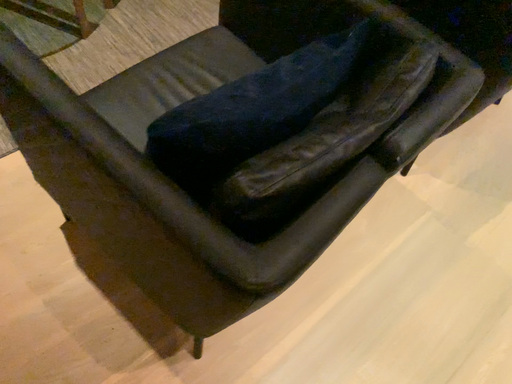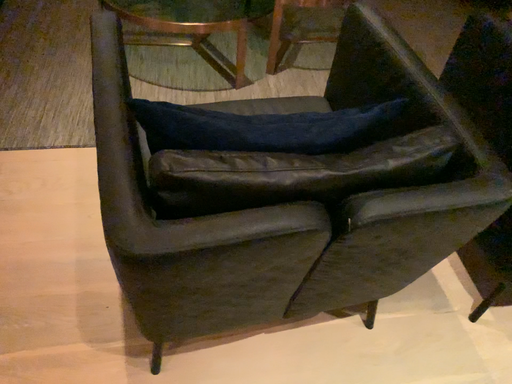
Question: How did the camera likely rotate when shooting the video?

Choices:
 (A) rotated left
 (B) rotated right

Answer: (A)